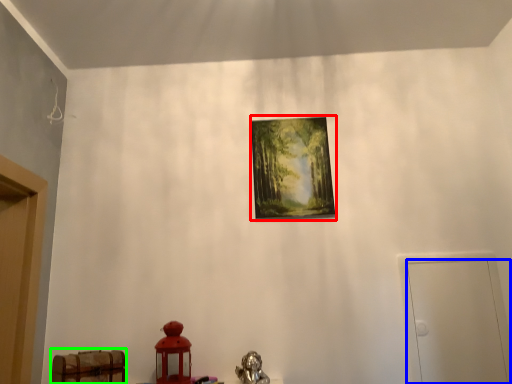
Question: Based on their relative distances, which object is farther from picture frame (highlighted by a red box)? Choose from door (highlighted by a blue box) and furniture (highlighted by a green box).

Choices:
 (A) door
 (B) furniture

Answer: (B)